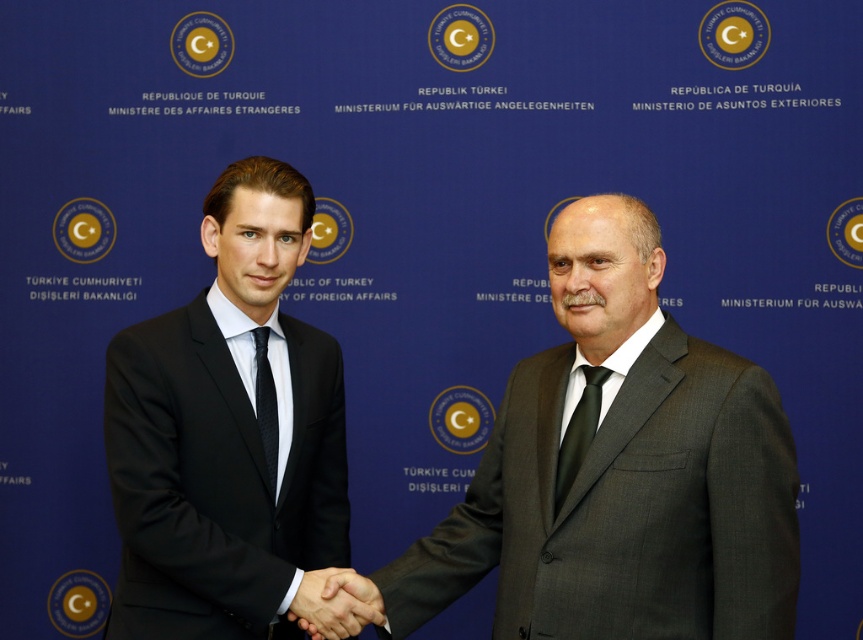
Is black suit at left to the right of matte black tie at right from the viewer's perspective?

In fact, black suit at left is to the left of matte black tie at right.

Who is more distant from viewer, (186, 552) or (557, 467)?

Point (557, 467)

Is point (336, 602) positioned before point (589, 438)?

That is False.

What are the coordinates of `black suit at left` in the screenshot? It's located at (230, 438).

Can you confirm if dark gray suit at center is positioned above smooth leather hand at center?

Correct, dark gray suit at center is located above smooth leather hand at center.

Between point (742, 541) and point (320, 604), which one is positioned in front?

Point (742, 541) is in front.

Identify the location of dark gray suit at center. (620, 472).

Is dark gray suit at center below black textured tie at center?

Correct, dark gray suit at center is located below black textured tie at center.

Can you confirm if dark gray suit at center is positioned to the right of black textured tie at center?

Yes, dark gray suit at center is to the right of black textured tie at center.

Identify the location of dark gray suit at center. (620, 472).